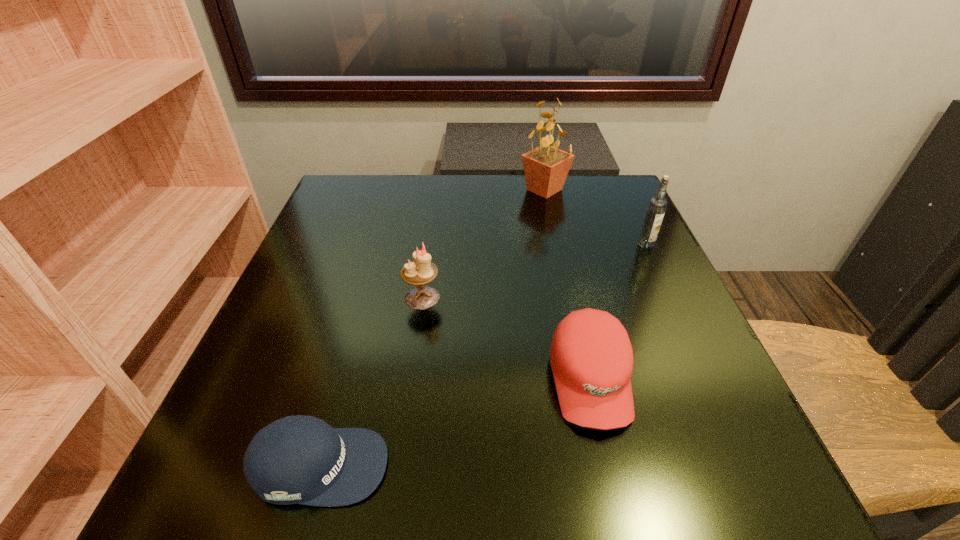
Find the location of a particular element. The image size is (960, 540). object that is at the near left corner is located at coordinates (298, 459).

Identify the location of object situated at the far right corner. (546, 167).

At what (x,y) coordinates should I click in order to perform the action: click on free space at the left edge of the desktop. Please return your answer as a coordinate pair (x, y). This screenshot has height=540, width=960. Looking at the image, I should click on (357, 285).

In the image, there is a desktop. Find the location of `vacant space at the right edge`. vacant space at the right edge is located at coordinates (649, 420).

In the image, there is a desktop. At what (x,y) coordinates should I click in order to perform the action: click on vacant space at the far left corner. Please return your answer as a coordinate pair (x, y). Image resolution: width=960 pixels, height=540 pixels. Looking at the image, I should click on (385, 188).

Where is `free space at the near left corner`? Image resolution: width=960 pixels, height=540 pixels. free space at the near left corner is located at coordinates (220, 451).

Locate an element on the screen. vacant area at the far right corner of the desktop is located at coordinates (585, 209).

Identify the location of free space at the near right corner. The height and width of the screenshot is (540, 960). (724, 465).

Where is `blank region between the fourth shortest object and the farthest object`? blank region between the fourth shortest object and the farthest object is located at coordinates (595, 217).

I want to click on vacant area that lies between the candle holder and the shortest object, so click(371, 382).